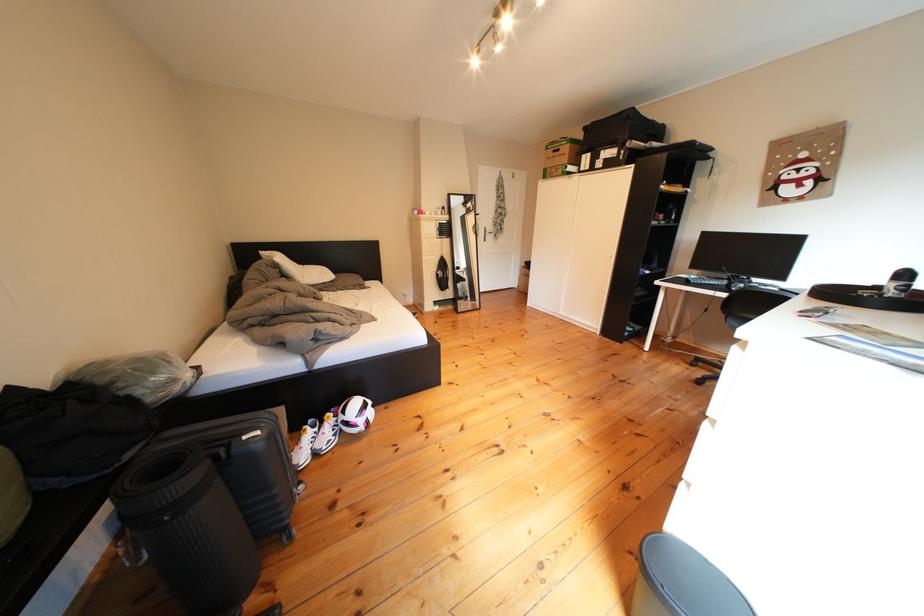
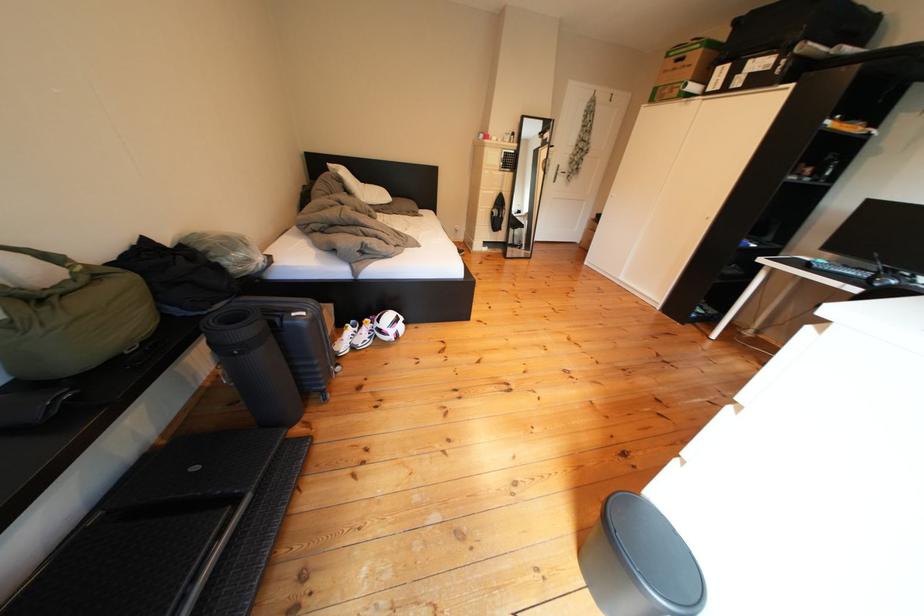
Where in the second image is the point corresponding to the point at 737,286 from the first image?

(880, 278)